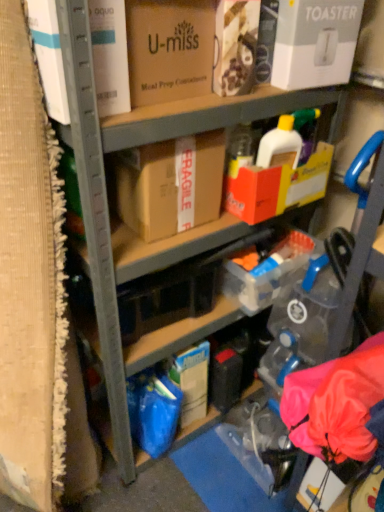
Question: From a real-world perspective, is matte cardboard box at upper center, placed as the third box when sorted from right to left, physically above brown cardboard box at center, the fourth box when ordered from right to left?

Choices:
 (A) no
 (B) yes

Answer: (B)

Question: Considering the relative sizes of matte cardboard box at upper center, placed as the third box when sorted from right to left, and brown cardboard box at center, the fourth box when ordered from right to left, in the image provided, is matte cardboard box at upper center, placed as the third box when sorted from right to left, taller than brown cardboard box at center, the fourth box when ordered from right to left,?

Choices:
 (A) yes
 (B) no

Answer: (B)

Question: Is the depth of matte cardboard box at upper center, positioned as the 3th box in left-to-right order, less than that of brown cardboard box at center, which is counted as the 2th box, starting from the left?

Choices:
 (A) yes
 (B) no

Answer: (A)

Question: Can you confirm if matte cardboard box at upper center, placed as the third box when sorted from right to left, is wider than brown cardboard box at center, the fourth box when ordered from right to left?

Choices:
 (A) yes
 (B) no

Answer: (B)

Question: Would you say brown cardboard box at center, the fourth box when ordered from right to left, is part of matte cardboard box at upper center, positioned as the 3th box in left-to-right order,'s contents?

Choices:
 (A) yes
 (B) no

Answer: (B)

Question: Does matte cardboard box at upper center, positioned as the 3th box in left-to-right order, turn towards brown cardboard box at center, which is counted as the 2th box, starting from the left?

Choices:
 (A) yes
 (B) no

Answer: (B)

Question: Is there a large distance between white cardboard toaster at upper right, positioned as the first box in right-to-left order, and yellow cardboard box at center, positioned as the fourth box in left-to-right order?

Choices:
 (A) yes
 (B) no

Answer: (B)

Question: From the image's perspective, does white cardboard toaster at upper right, marked as the 5th box in a left-to-right arrangement, appear lower than yellow cardboard box at center, positioned as the fourth box in left-to-right order?

Choices:
 (A) no
 (B) yes

Answer: (A)

Question: Considering the relative sizes of white cardboard toaster at upper right, marked as the 5th box in a left-to-right arrangement, and yellow cardboard box at center, positioned as the fourth box in left-to-right order, in the image provided, is white cardboard toaster at upper right, marked as the 5th box in a left-to-right arrangement, smaller than yellow cardboard box at center, positioned as the fourth box in left-to-right order,?

Choices:
 (A) yes
 (B) no

Answer: (A)

Question: From a real-world perspective, is white cardboard toaster at upper right, marked as the 5th box in a left-to-right arrangement, below yellow cardboard box at center, positioned as the fourth box in left-to-right order?

Choices:
 (A) yes
 (B) no

Answer: (B)

Question: Considering the relative sizes of white cardboard toaster at upper right, positioned as the first box in right-to-left order, and yellow cardboard box at center, positioned as the fourth box in left-to-right order, in the image provided, is white cardboard toaster at upper right, positioned as the first box in right-to-left order, taller than yellow cardboard box at center, positioned as the fourth box in left-to-right order,?

Choices:
 (A) yes
 (B) no

Answer: (A)

Question: Is white cardboard toaster at upper right, positioned as the first box in right-to-left order, turned away from yellow cardboard box at center, the 2th box when ordered from right to left?

Choices:
 (A) yes
 (B) no

Answer: (B)

Question: Can you confirm if matte cardboard box at upper center, acting as the 1th box starting from the left, is bigger than brown cardboard box at center, which is counted as the 2th box, starting from the left?

Choices:
 (A) yes
 (B) no

Answer: (B)